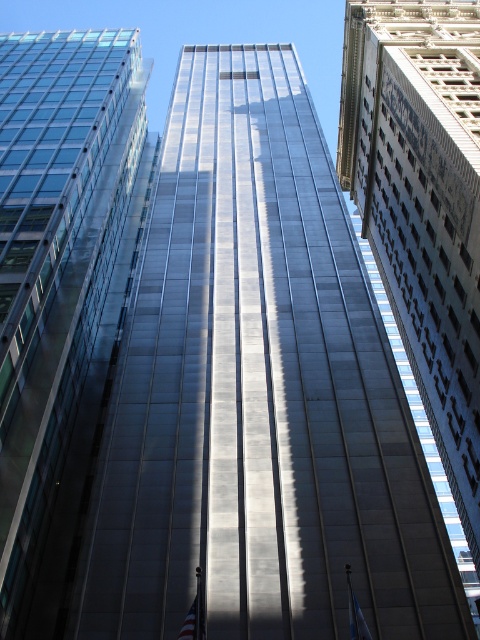
Which is more to the left, glassy reflective skyscraper at left or reflective glass skyscraper at center?

glassy reflective skyscraper at left

Can you confirm if glassy reflective skyscraper at left is taller than reflective glass skyscraper at center?

Incorrect, glassy reflective skyscraper at left's height is not larger of reflective glass skyscraper at center's.

Does point (142, 90) come closer to viewer compared to point (373, 115)?

That is False.

Where is `glassy reflective skyscraper at left`? This screenshot has width=480, height=640. glassy reflective skyscraper at left is located at coordinates (55, 260).

Does american flag at lower center have a lesser width compared to blue fabric flag at center?

Incorrect, american flag at lower center's width is not less than blue fabric flag at center's.

Who is shorter, american flag at lower center or blue fabric flag at center?

blue fabric flag at center

Which is in front, point (192, 632) or point (360, 632)?

Positioned in front is point (360, 632).

The image size is (480, 640). What are the coordinates of `american flag at lower center` in the screenshot? It's located at (194, 616).

From the picture: Does glassy reflective skyscraper at left have a lesser width compared to american flag at lower center?

No.

Is glassy reflective skyscraper at left bigger than american flag at lower center?

Yes.

Describe the element at coordinates (55, 260) in the screenshot. I see `glassy reflective skyscraper at left` at that location.

Locate an element on the screen. This screenshot has width=480, height=640. glassy reflective skyscraper at left is located at coordinates tap(55, 260).